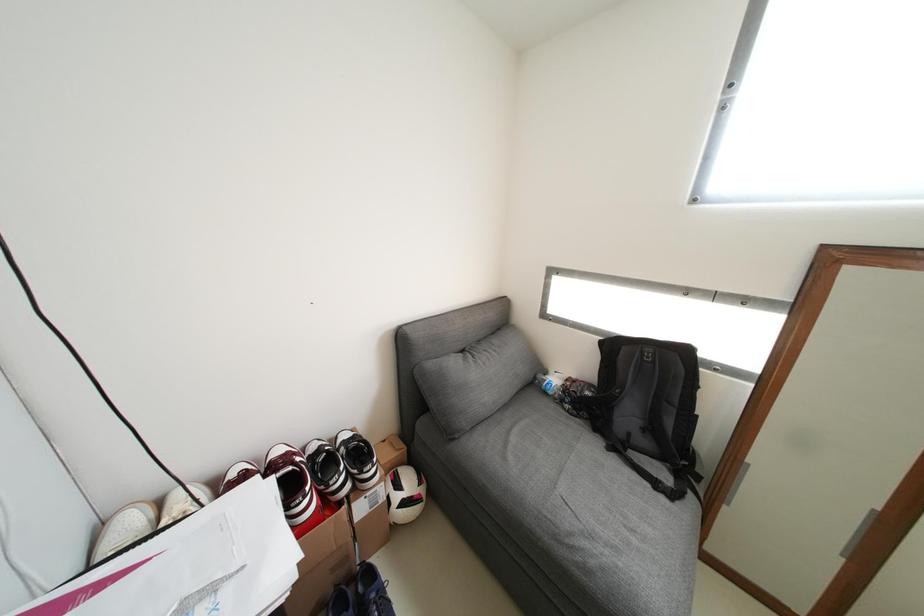
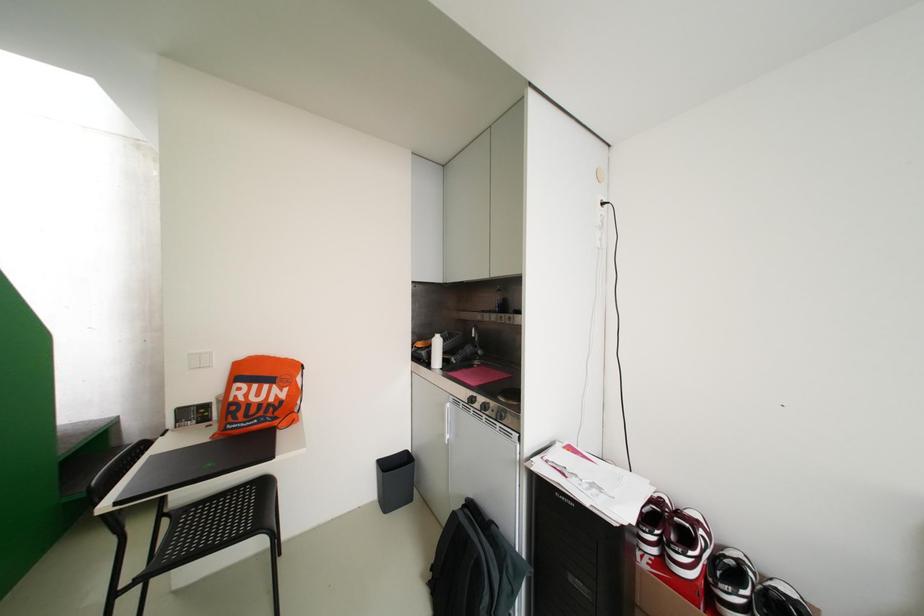
Question: How did the camera likely rotate?

Choices:
 (A) Left
 (B) Right
 (C) Up
 (D) Down

Answer: (A)